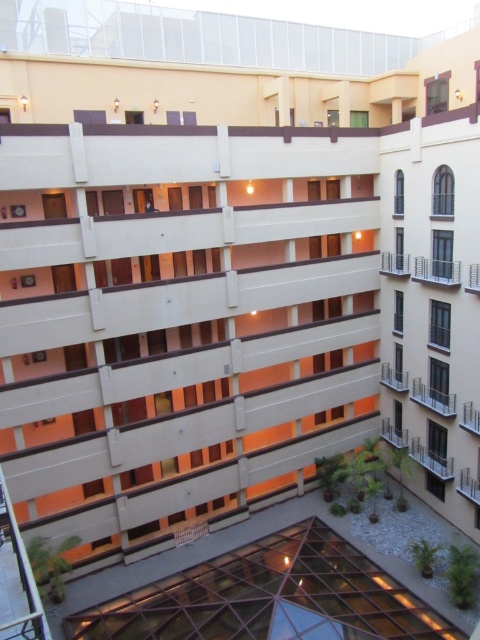
You are standing in front of the building and looking at the two points marked on the image. Which point, point (359, 618) or point (386, 381), is closer to you?

Point (359, 618) is closer to the camera than point (386, 381), so it is closer to you.